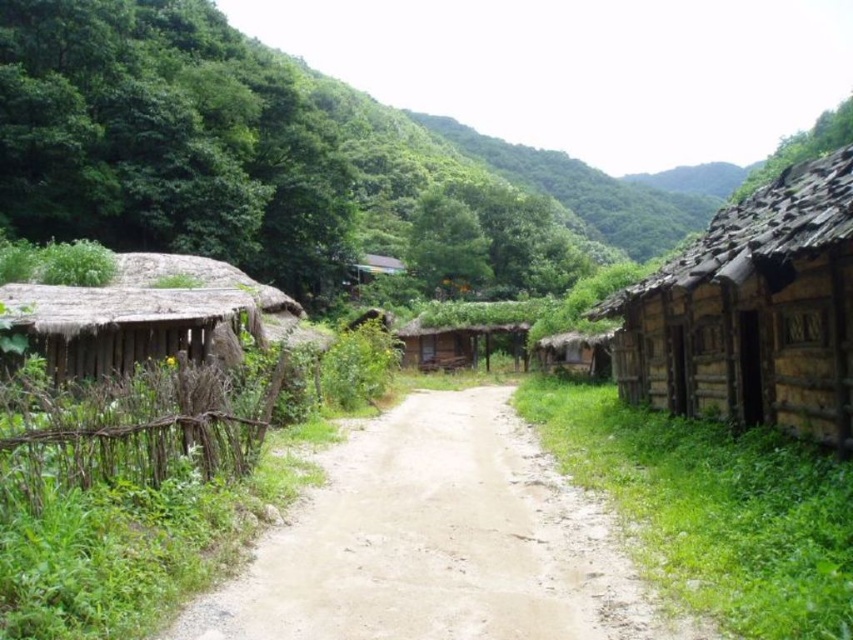
Which is below, brown dirt track at center or brown thatched hut at center?

brown dirt track at center is below.

Who is positioned more to the left, brown dirt track at center or brown thatched hut at center?

From the viewer's perspective, brown dirt track at center appears more on the left side.

Is point (337, 579) positioned in front of point (418, 368)?

Yes, point (337, 579) is closer to viewer.

Find the location of a particular element. The height and width of the screenshot is (640, 853). brown dirt track at center is located at coordinates (438, 541).

Can you confirm if brown dirt track at center is positioned above rustic wooden hut at right?

No.

Is brown dirt track at center shorter than rustic wooden hut at right?

Yes, brown dirt track at center is shorter than rustic wooden hut at right.

Does point (386, 509) come in front of point (845, 195)?

No, it is not.

At what (x,y) coordinates should I click in order to perform the action: click on brown dirt track at center. Please return your answer as a coordinate pair (x, y). This screenshot has width=853, height=640. Looking at the image, I should click on (438, 541).

Who is shorter, rustic wooden hut at right or brown thatched hut at center?

Standing shorter between the two is brown thatched hut at center.

Can you confirm if rustic wooden hut at right is smaller than brown thatched hut at center?

Incorrect, rustic wooden hut at right is not smaller in size than brown thatched hut at center.

Which is in front, point (820, 340) or point (523, 324)?

Point (820, 340) is more forward.

Where is `rustic wooden hut at right`? rustic wooden hut at right is located at coordinates (752, 310).